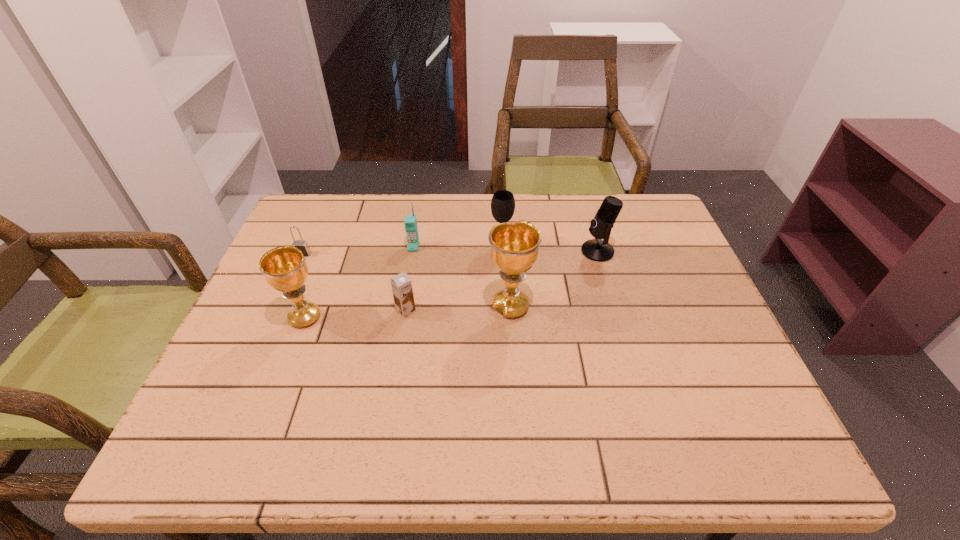
Please point out where to position a new chalice on the right to maintain spacing. Please provide its 2D coordinates. Your answer should be formatted as a tuple, i.e. [(x, y)], where the tuple contains the x and y coordinates of a point satisfying the conditions above.

[(707, 296)]